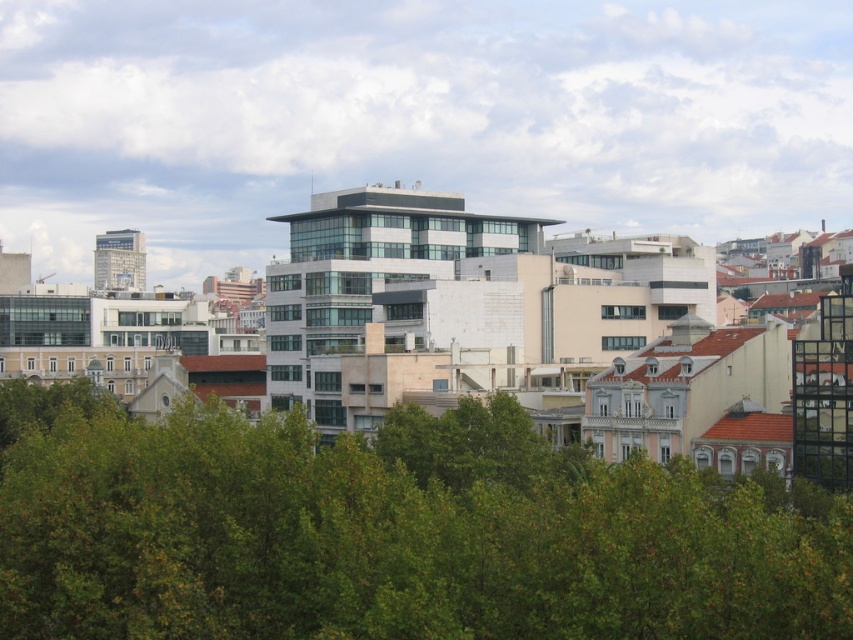
Question: Which of the following is the closest to the observer?

Choices:
 (A) matte glass skyscraper at left
 (B) green leafy tree at center

Answer: (B)

Question: Is green leafy tree at center above matte glass skyscraper at left?

Choices:
 (A) yes
 (B) no

Answer: (B)

Question: Is green leafy tree at center to the left of matte glass skyscraper at left from the viewer's perspective?

Choices:
 (A) yes
 (B) no

Answer: (B)

Question: Is green leafy tree at center bigger than matte glass skyscraper at left?

Choices:
 (A) no
 (B) yes

Answer: (A)